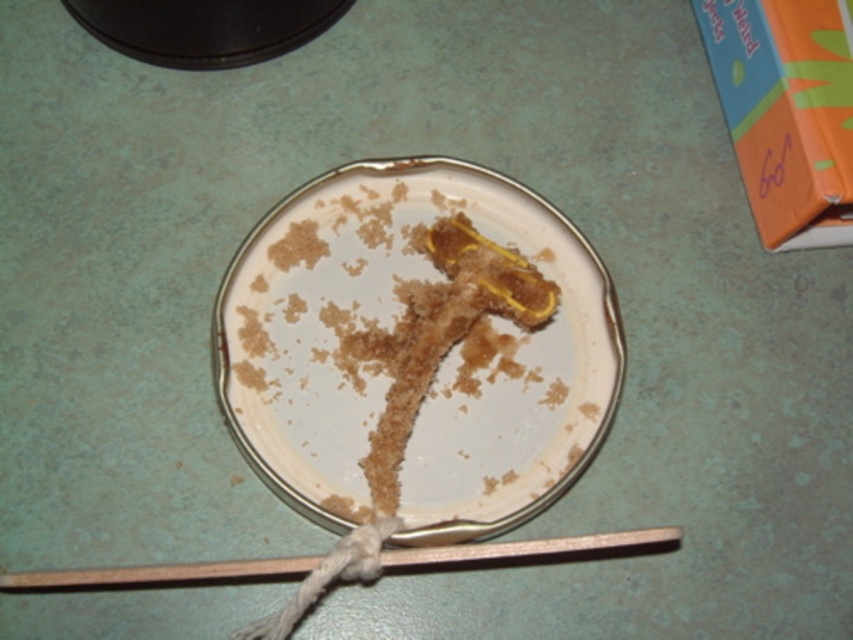
You are setting up a small snack station and have both the white glossy plate at center and the wooden chopstick at lower center. Which object should you choose if you need something to hold a cookie?

The white glossy plate at center is larger in size than the wooden chopstick at lower center, so the white glossy plate at center would be better for holding a cookie.

You are trying to place a small toy that requires 10 cm of vertical space on the white glossy plate at center or the wooden chopstick at lower center. Which object can accommodate the toy vertically?

The white glossy plate at center is much taller than the wooden chopstick at lower center, so it can accommodate the toy vertically.

You are setting up a table for a small snack. You have a white glossy plate at center and a wooden chopstick at lower center. Where should you place the chopstick relative to the plate?

The white glossy plate at center is to the right of the wooden chopstick at lower center, so you should place the wooden chopstick at lower center to the left of the white glossy plate at center.